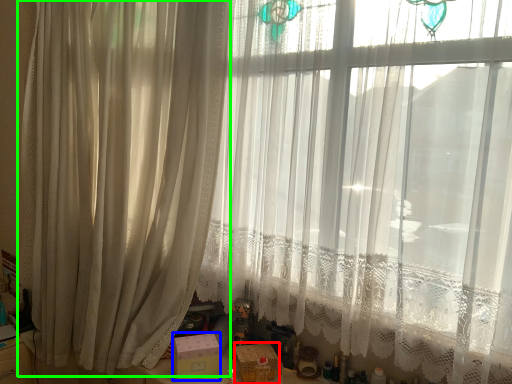
Question: Which is nearer to the box (highlighted by a red box)? box (highlighted by a blue box) or curtain (highlighted by a green box).

Choices:
 (A) box
 (B) curtain

Answer: (A)